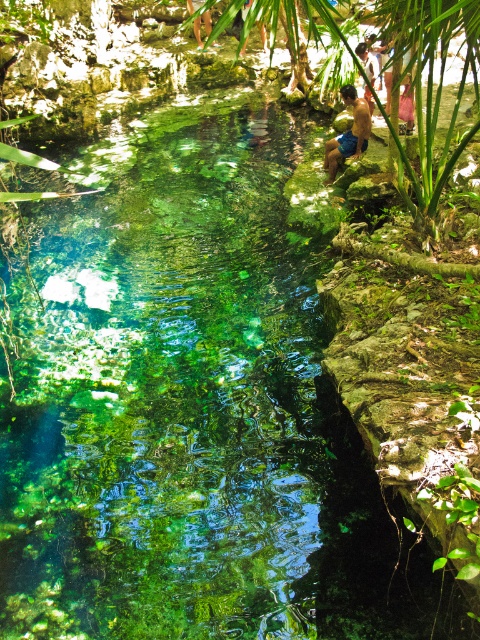
Question: Is brown textured shirt at upper center to the left of smooth skin person at upper center from the viewer's perspective?

Choices:
 (A) no
 (B) yes

Answer: (A)

Question: Does blue denim shorts at upper right have a greater width compared to brown textured shirt at upper center?

Choices:
 (A) yes
 (B) no

Answer: (A)

Question: Considering the real-world distances, which object is closest to the smooth skin person at upper center?

Choices:
 (A) brown textured shirt at upper center
 (B) blue denim shorts at upper right

Answer: (B)

Question: Which point is closer to the camera?

Choices:
 (A) (356, 49)
 (B) (194, 33)
 (C) (354, 106)

Answer: (C)

Question: Where is blue denim shorts at upper right located in relation to smooth skin person at upper center in the image?

Choices:
 (A) below
 (B) above

Answer: (A)

Question: Which object is closer to the camera taking this photo?

Choices:
 (A) blue denim shorts at upper right
 (B) brown textured shirt at upper center
 (C) smooth skin person at upper center

Answer: (C)